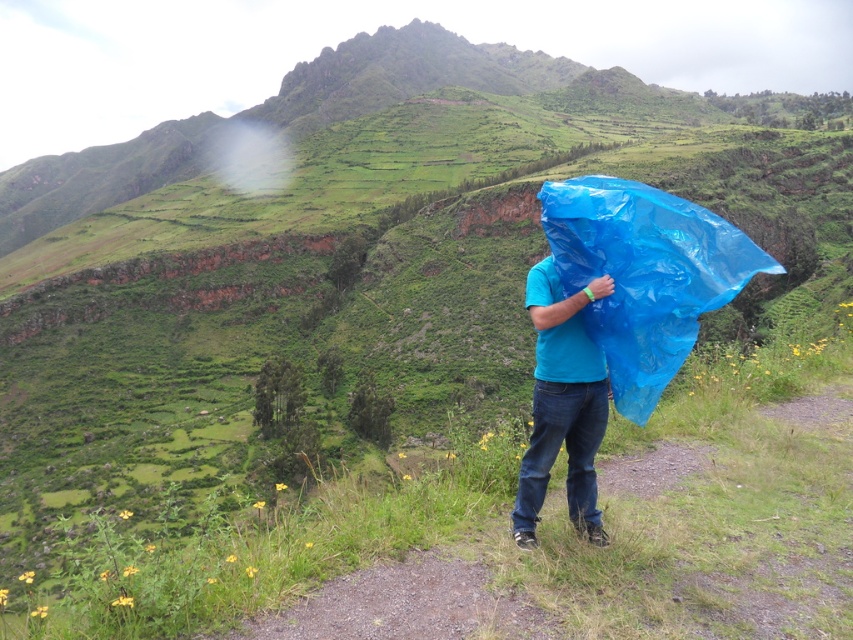
Question: Which object is closer to the camera taking this photo?

Choices:
 (A) blue matte plastic bag at center
 (B) blue plastic bag at center

Answer: (B)

Question: In this image, where is blue plastic bag at center located relative to blue matte plastic bag at center?

Choices:
 (A) left
 (B) right

Answer: (B)

Question: Can you confirm if blue plastic bag at center is bigger than blue matte plastic bag at center?

Choices:
 (A) no
 (B) yes

Answer: (B)

Question: Which object is farther from the camera taking this photo?

Choices:
 (A) blue matte plastic bag at center
 (B) blue plastic bag at center

Answer: (A)

Question: Can you confirm if blue plastic bag at center is thinner than blue matte plastic bag at center?

Choices:
 (A) yes
 (B) no

Answer: (B)